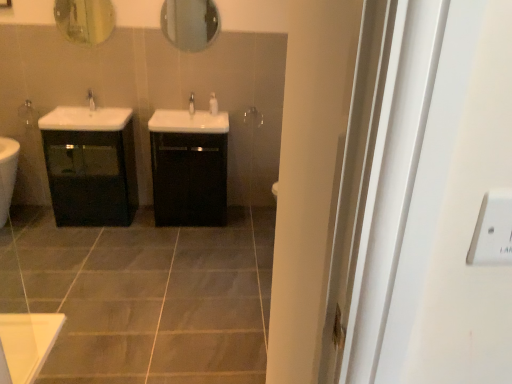
Question: In the image, is gray matte tile at center on the left side or the right side of matte glass mirror at upper left, the 2th mirror from the right?

Choices:
 (A) right
 (B) left

Answer: (A)

Question: Is gray matte tile at center bigger or smaller than matte glass mirror at upper left, arranged as the 1th mirror when viewed from the left?

Choices:
 (A) big
 (B) small

Answer: (A)

Question: Estimate the real-world distances between objects in this image. Which object is closer to the matte glass mirror at upper left, arranged as the 1th mirror when viewed from the left?

Choices:
 (A) glossy glass mirror at upper center, which is the second mirror from left to right
 (B) black glossy cabinet at center, arranged as the 1th bathroom cabinet when viewed from the right
 (C) gray matte tile at center
 (D) matte black cabinet at left, the first bathroom cabinet positioned from the left
 (E) matte silver faucet at center, the 1th tap in the left-to-right sequence

Answer: (E)

Question: Which object is positioned farthest from the white glossy soap dispenser at center?

Choices:
 (A) white glossy tap at center, which appears as the 1th tap when viewed from the right
 (B) black glossy cabinet at center, which appears as the 2th bathroom cabinet when viewed from the left
 (C) glossy glass mirror at upper center, marked as the first mirror in a right-to-left arrangement
 (D) matte glass mirror at upper left, the 2th mirror from the right
 (E) gray matte tile at center

Answer: (E)